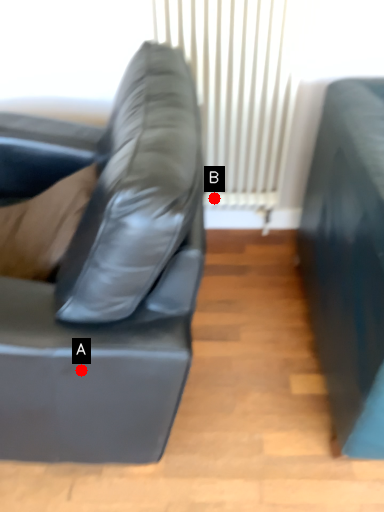
Question: Two points are circled on the image, labeled by A and B beside each circle. Which point is closer to the camera?

Choices:
 (A) A is closer
 (B) B is closer

Answer: (A)